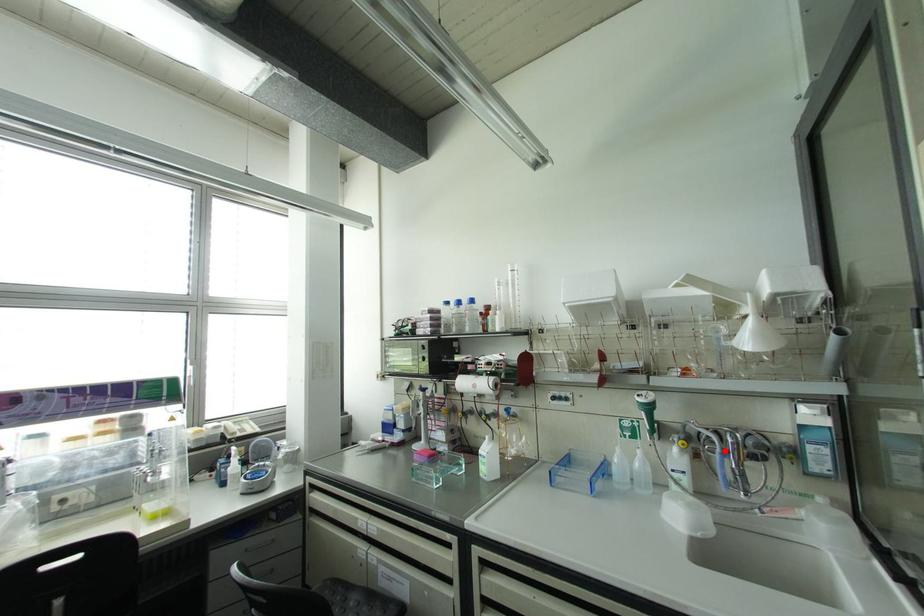
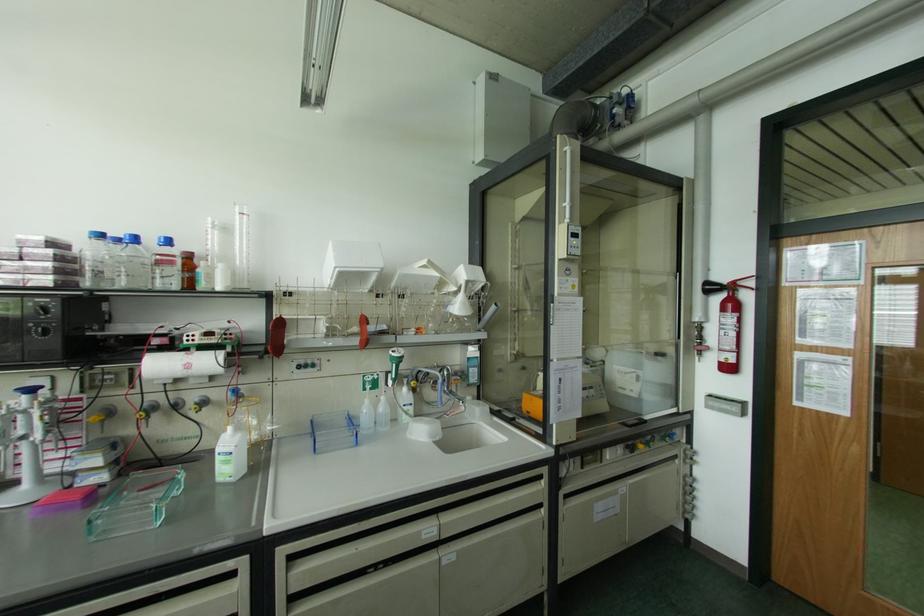
The point at the highlighted location is marked in the first image. Where is the corresponding point in the second image?

(444, 379)